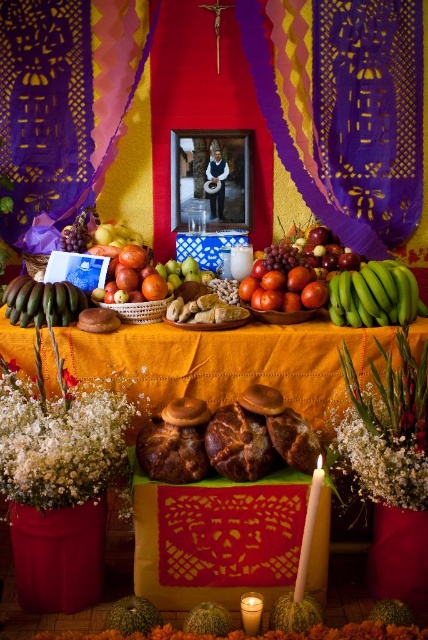
Question: Does white fluffy flowers at lower center appear under yellow matte apples at center?

Choices:
 (A) no
 (B) yes

Answer: (B)

Question: Which object is closer to the camera taking this photo?

Choices:
 (A) shiny red tomatoes at center
 (B) green matte bananas at left
 (C) white fluffy flowers at center

Answer: (C)

Question: Estimate the real-world distances between objects in this image. Which object is farther from the white fluffy flowers at lower center?

Choices:
 (A) yellow matte apples at center
 (B) golden textured bread at center
 (C) white wax candle at lower center

Answer: (A)

Question: Can you confirm if shiny red tomatoes at center is smaller than green matte bananas at left?

Choices:
 (A) no
 (B) yes

Answer: (A)

Question: Which point is farther from the camera taking this photo?

Choices:
 (A) (278, 289)
 (B) (115, 236)
 (C) (112, 260)

Answer: (B)

Question: Considering the relative positions of shiny red apples at center and yellow matte apples at center in the image provided, where is shiny red apples at center located with respect to yellow matte apples at center?

Choices:
 (A) left
 (B) right

Answer: (B)